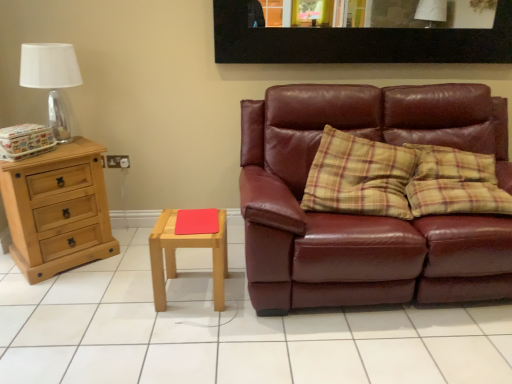
This screenshot has height=384, width=512. What are the coordinates of `free space below light brown wooden stool at center (from a real-world perspective)` in the screenshot? It's located at tap(190, 291).